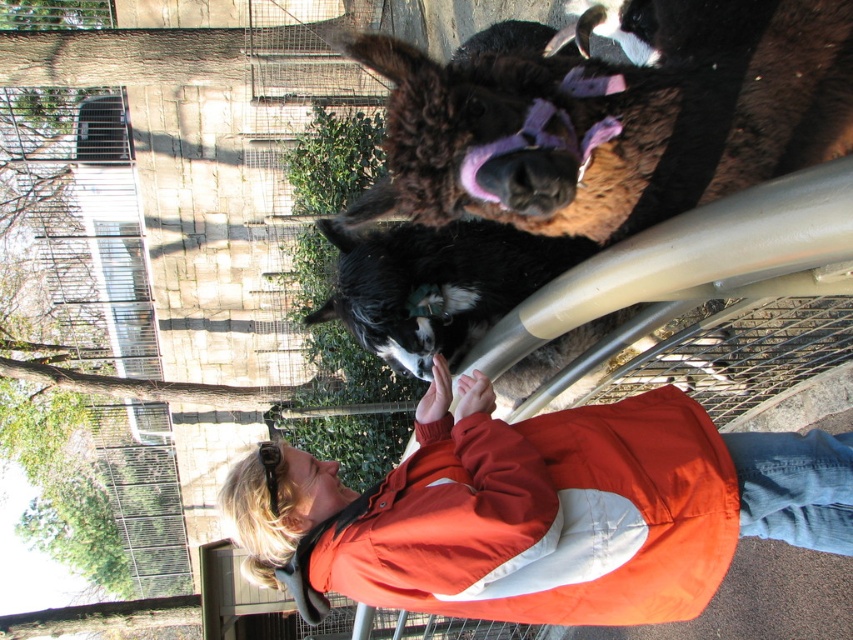
You are a zookeeper who needs to feed the animals. You have a bag of hay and see the orange fabric jacket at upper center and the brown fuzzy donkey at upper center. Which one is closer to you, and should you prioritize feeding the donkey first?

The brown fuzzy donkey at upper center is behind the orange fabric jacket at upper center, so the orange fabric jacket at upper center is closer to you. However, since the donkey is an animal, you should prioritize feeding the brown fuzzy donkey at upper center first before attending to the jacket.

You are a zookeeper trying to locate the orange fabric jacket at upper center. According to the scene description, where exactly is the orange fabric jacket positioned?

The orange fabric jacket at upper center is located at point (543, 509).